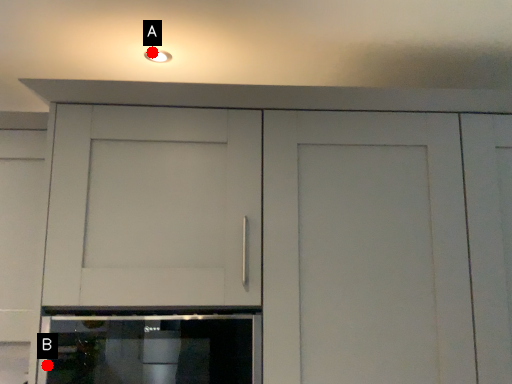
Question: Two points are circled on the image, labeled by A and B beside each circle. Which point is closer to the camera taking this photo?

Choices:
 (A) A is closer
 (B) B is closer

Answer: (B)